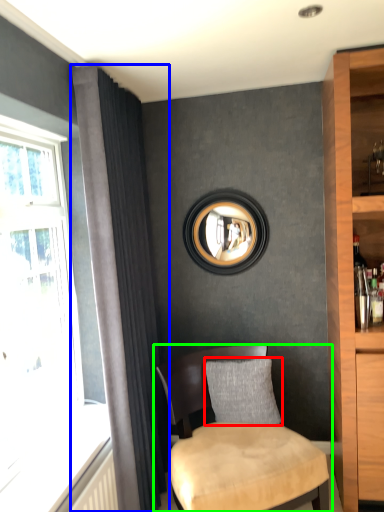
Question: Based on their relative distances, which object is nearer to pillow (highlighted by a red box)? Choose from curtain (highlighted by a blue box) and chair (highlighted by a green box).

Choices:
 (A) curtain
 (B) chair

Answer: (B)